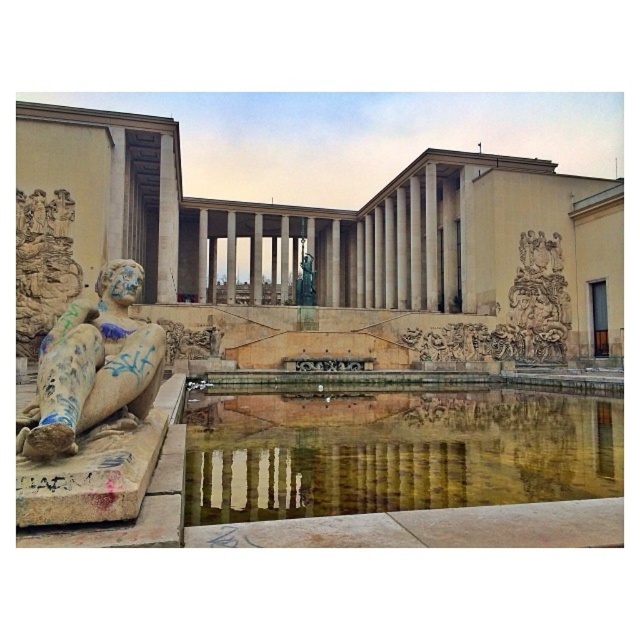
Question: Which of the following is the farthest from the observer?

Choices:
 (A) reflective stone pool at center
 (B) green polished stone statue at center
 (C) stone statue at left

Answer: (B)

Question: Is reflective stone pool at center closer to camera compared to green polished stone statue at center?

Choices:
 (A) no
 (B) yes

Answer: (B)

Question: Does reflective stone pool at center have a larger size compared to green polished stone statue at center?

Choices:
 (A) no
 (B) yes

Answer: (A)

Question: Which of these objects is positioned farthest from the green polished stone statue at center?

Choices:
 (A) stone statue at left
 (B) reflective stone pool at center

Answer: (A)

Question: Can you confirm if stone statue at left is positioned to the left of green polished stone statue at center?

Choices:
 (A) yes
 (B) no

Answer: (A)

Question: Among these points, which one is farthest from the camera?

Choices:
 (A) (35, 392)
 (B) (339, 397)
 (C) (296, 296)

Answer: (C)